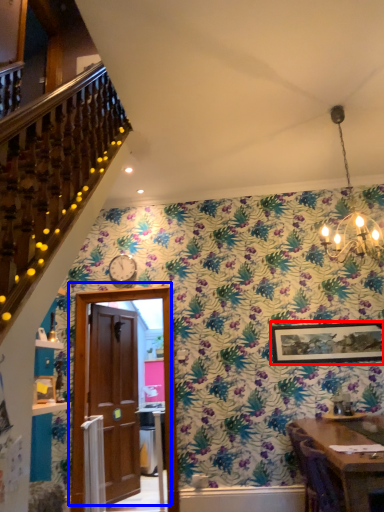
Question: Which object appears farthest to the camera in this image, picture frame (highlighted by a red box) or door (highlighted by a blue box)?

Choices:
 (A) picture frame
 (B) door

Answer: (A)